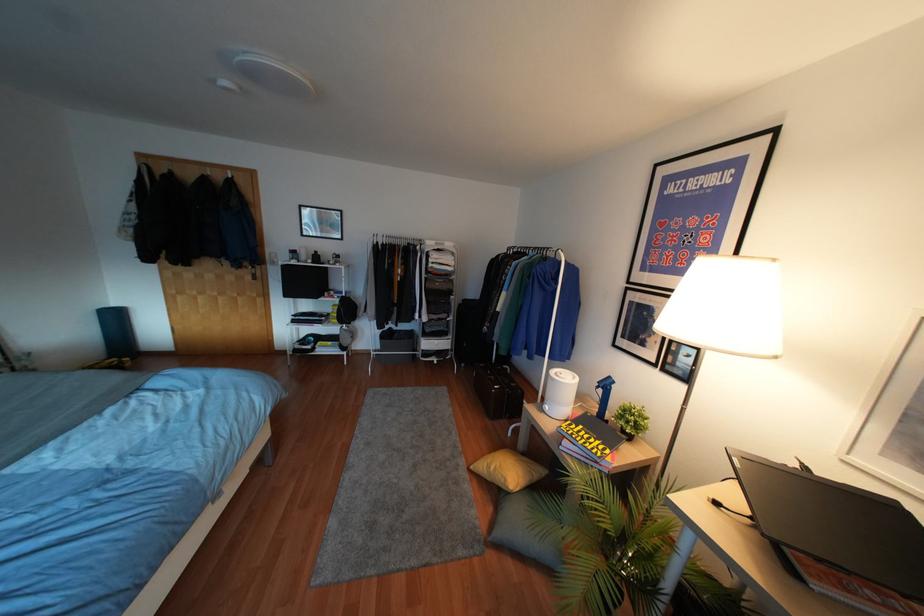
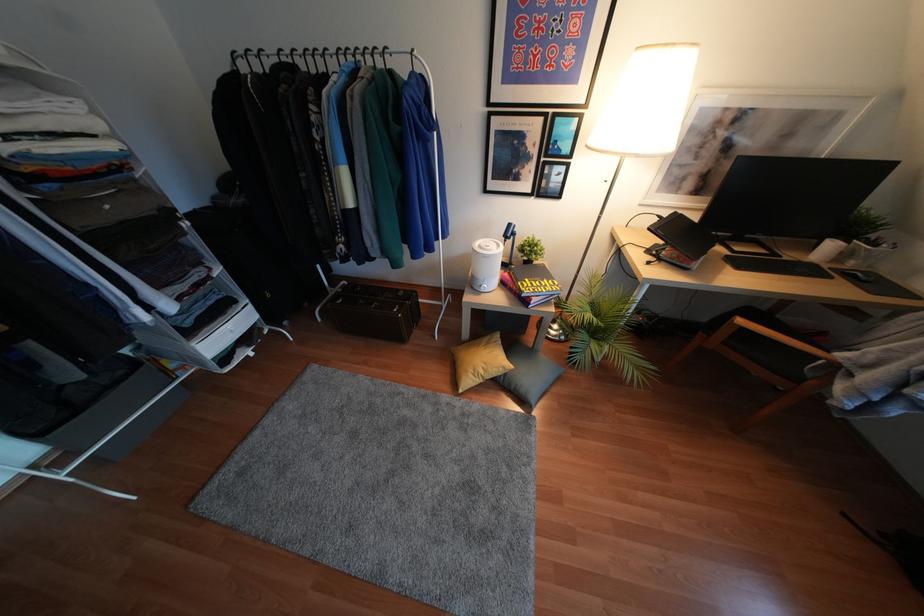
Find the pixel in the second image that matches point 462,461 in the first image.

(445, 397)